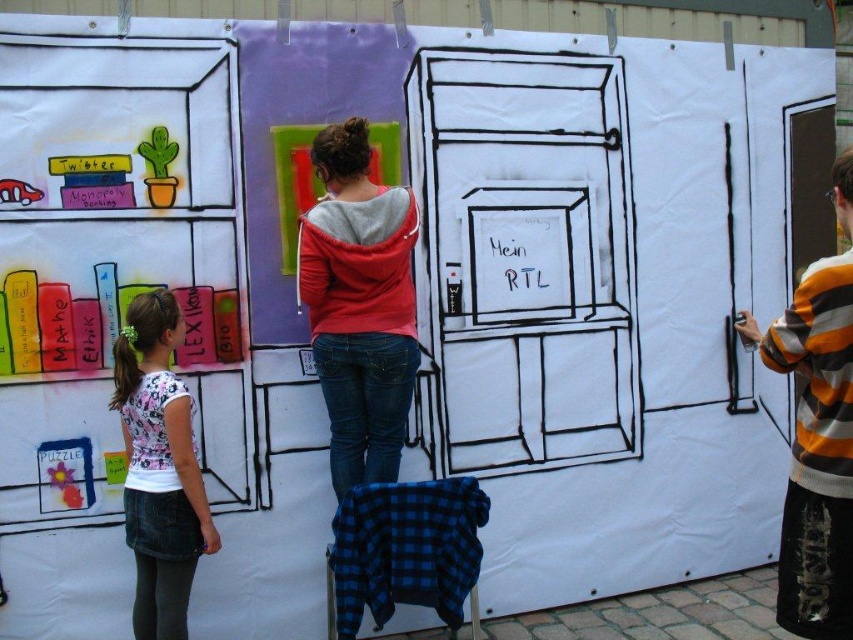
Question: Which point is farther to the camera?

Choices:
 (A) (813, 564)
 (B) (389, 401)

Answer: (B)

Question: Which point is farther to the camera?

Choices:
 (A) white printed shirt at left
 (B) striped sweater at right
 (C) red hoodie at center

Answer: (C)

Question: Can you confirm if red hoodie at center is positioned above striped sweater at right?

Choices:
 (A) yes
 (B) no

Answer: (A)

Question: Can you confirm if striped sweater at right is positioned to the right of white printed shirt at left?

Choices:
 (A) yes
 (B) no

Answer: (A)

Question: Which point appears farthest from the camera in this image?

Choices:
 (A) (300, 225)
 (B) (138, 476)

Answer: (A)

Question: Is striped sweater at right behind white printed shirt at left?

Choices:
 (A) yes
 (B) no

Answer: (B)